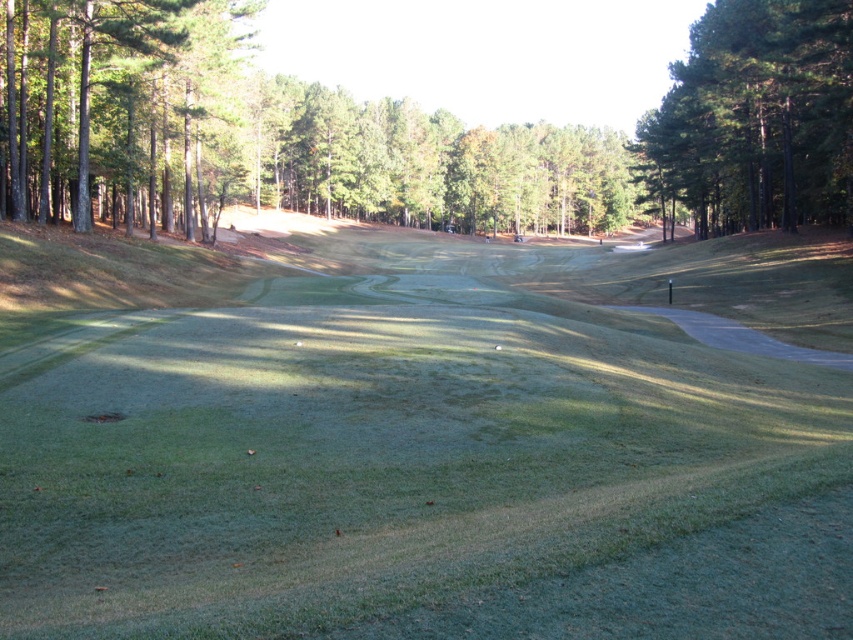
You are a golfer standing on the green grassy field at center and want to hit the ball towards the fairway in the middle ground. Considering the position of the green textured tree at left, which direction should you aim to avoid hitting the tree?

The green grassy field at center is positioned under the green textured tree at left, so you should aim to the right of the tree to avoid hitting it.

You are a golfer standing at the tee, looking down the fairway. You notice two points marked on the course. Which of the two points, point (450, 394) or point (811, 209), is closer to your current position?

Point (450, 394) is closer to the viewer than point (811, 209), so the point closer to your current position is point (450, 394).

Based on the scene description, where is the green grassy field at center located in terms of coordinates?

The green grassy field at center is located at point coordinates of (437, 451).